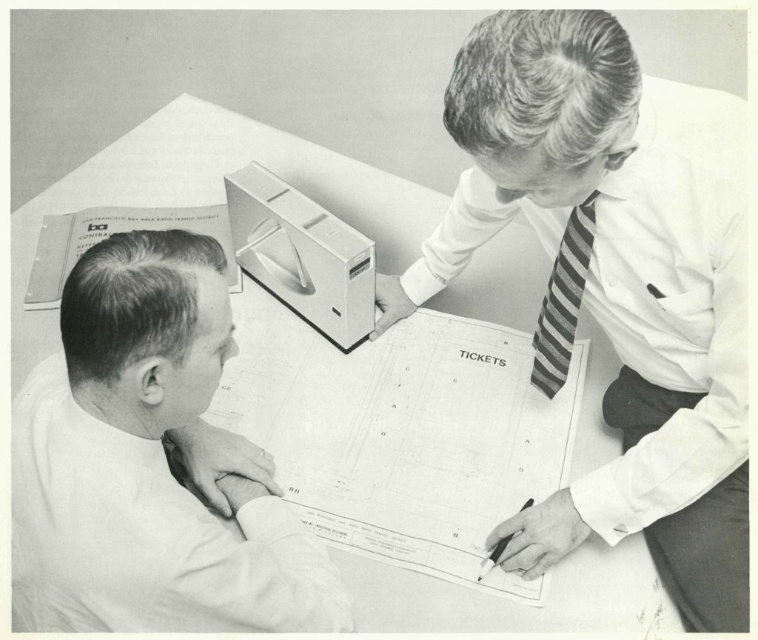
Can you confirm if white paper at upper center is shorter than striped fabric tie at upper right?

Incorrect, white paper at upper center's height does not fall short of striped fabric tie at upper right's.

Is white paper at upper center thinner than striped fabric tie at upper right?

No.

Between point (255, 145) and point (550, 388), which one is positioned in front?

Positioned in front is point (550, 388).

Locate an element on the screen. Image resolution: width=758 pixels, height=640 pixels. white paper at upper center is located at coordinates (208, 193).

From the picture: Between white paper at upper center and black plastic pen at lower center, which one is positioned higher?

white paper at upper center is higher up.

Which is behind, point (196, 140) or point (533, 499)?

The point (196, 140) is more distant.

Find the location of `white paper at upper center`. white paper at upper center is located at coordinates (208, 193).

Describe the element at coordinates (606, 298) in the screenshot. I see `white striped tie at upper center` at that location.

Does point (634, 352) come in front of point (528, 499)?

No, it is behind (528, 499).

Between point (738, 525) and point (497, 556), which one is positioned behind?

The point (497, 556) is behind.

This screenshot has width=758, height=640. Identify the location of white striped tie at upper center. (606, 298).